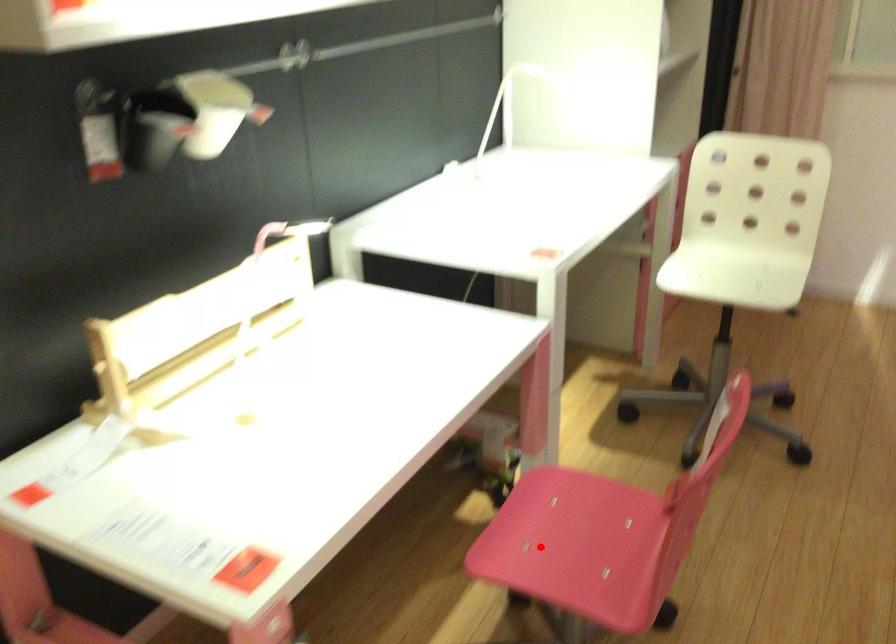
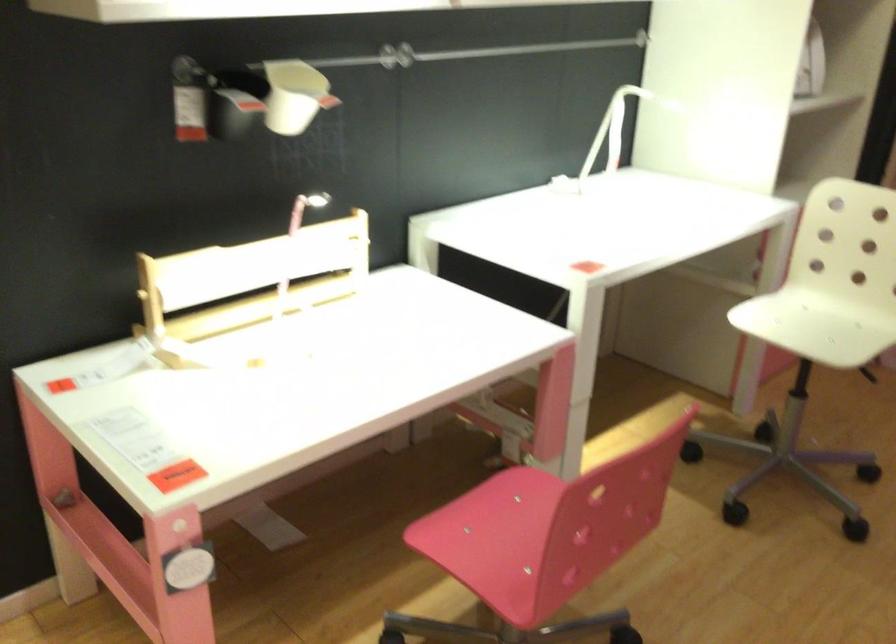
In the second image, find the point that corresponds to the highlighted location in the first image.

(479, 535)